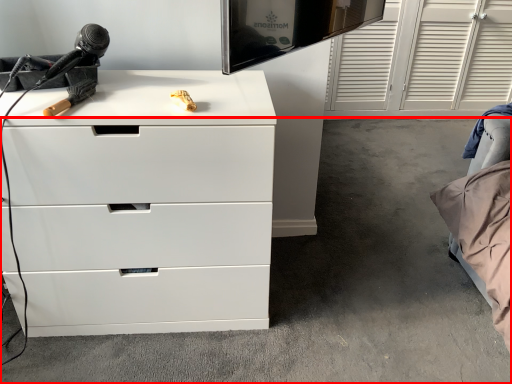
Question: From the image's perspective, considering the relative positions of concrete (annotated by the red box) and chest of drawers in the image provided, where is concrete (annotated by the red box) located with respect to the staircase?

Choices:
 (A) above
 (B) below

Answer: (A)